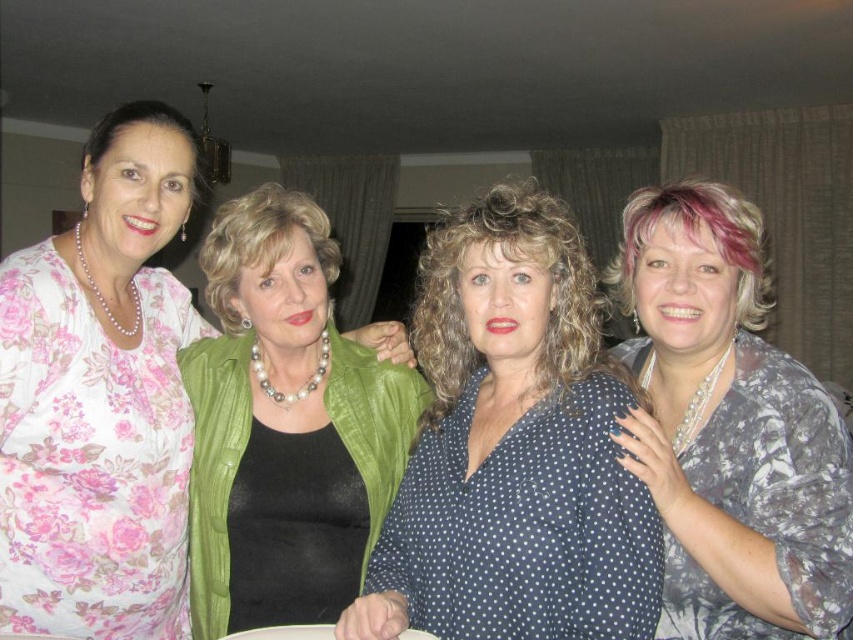
Question: Which object is positioned closest to the printed silk blouse at right?

Choices:
 (A) polka dot blouse at center
 (B) pearl necklace at center
 (C) floral fabric blouse at left

Answer: (A)

Question: Based on their relative distances, which object is nearer to the polka dot blouse at center?

Choices:
 (A) printed silk blouse at right
 (B) floral fabric blouse at left
 (C) pearl necklace at center

Answer: (A)

Question: Does floral fabric blouse at left lie behind printed silk blouse at right?

Choices:
 (A) no
 (B) yes

Answer: (B)

Question: Which object is positioned farthest from the floral fabric blouse at left?

Choices:
 (A) polka dot blouse at center
 (B) pearl necklace at center
 (C) printed silk blouse at right

Answer: (C)

Question: Can you confirm if floral fabric blouse at left is thinner than printed silk blouse at right?

Choices:
 (A) no
 (B) yes

Answer: (B)

Question: Can you confirm if floral fabric blouse at left is positioned to the left of printed silk blouse at right?

Choices:
 (A) yes
 (B) no

Answer: (A)